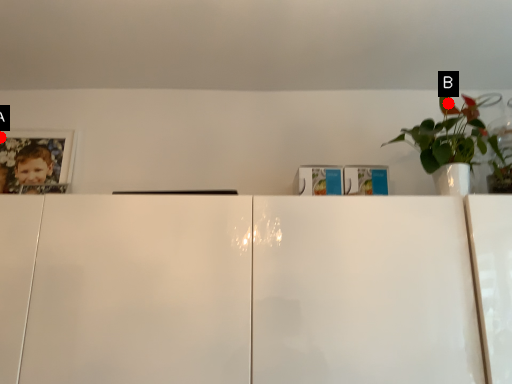
Question: Two points are circled on the image, labeled by A and B beside each circle. Which of the following is the farthest from the observer?

Choices:
 (A) A is further
 (B) B is further

Answer: (A)